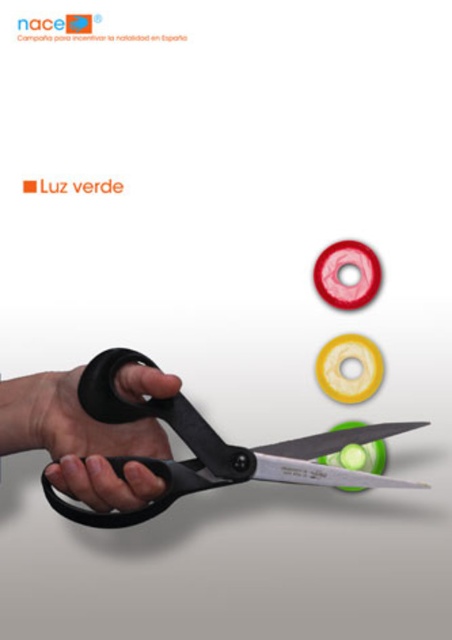
Question: Which object is closer to the camera taking this photo?

Choices:
 (A) black matte scissors at center
 (B) black plastic scissors at center

Answer: (A)

Question: Can you confirm if black plastic scissors at center is positioned above black matte scissors at center?

Choices:
 (A) yes
 (B) no

Answer: (B)

Question: Where is black plastic scissors at center located in relation to black matte scissors at center in the image?

Choices:
 (A) above
 (B) below

Answer: (B)

Question: Is the position of black plastic scissors at center less distant than that of black matte scissors at center?

Choices:
 (A) no
 (B) yes

Answer: (A)